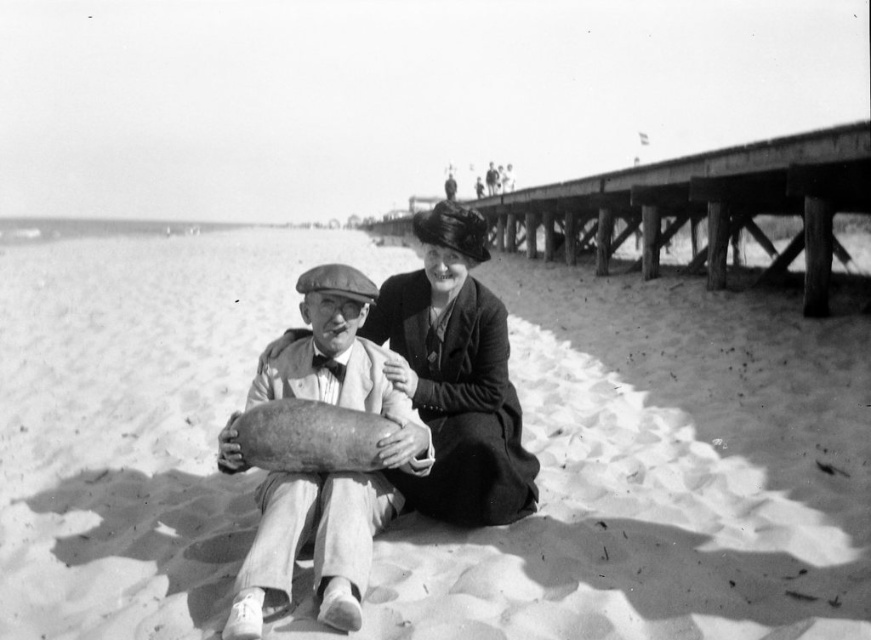
You are a photographer who wants to capture a closeup shot of the smooth wooden cylinder at center without the wooden pier at upper right appearing in the frame. Based on their heights, is this possible?

The wooden pier at upper right is much taller than the smooth wooden cylinder at center, so it might be challenging to avoid capturing the pier in the frame unless you adjust your angle or position to focus solely on the cylinder.

You are standing at the point marked as point (703, 205) in the image. Looking towards the wooden pier at upper right, which direction should you face to see the wooden pier at upper right?

You should face north to see the wooden pier at upper right because it is located at upper right relative to your position at point (703, 205).

Based on the scene described, which object is positioned higher in the image, the wooden pier at upper right or the smooth fabric dress at center?

The wooden pier at upper right is positioned higher than the smooth fabric dress at center according to the description.